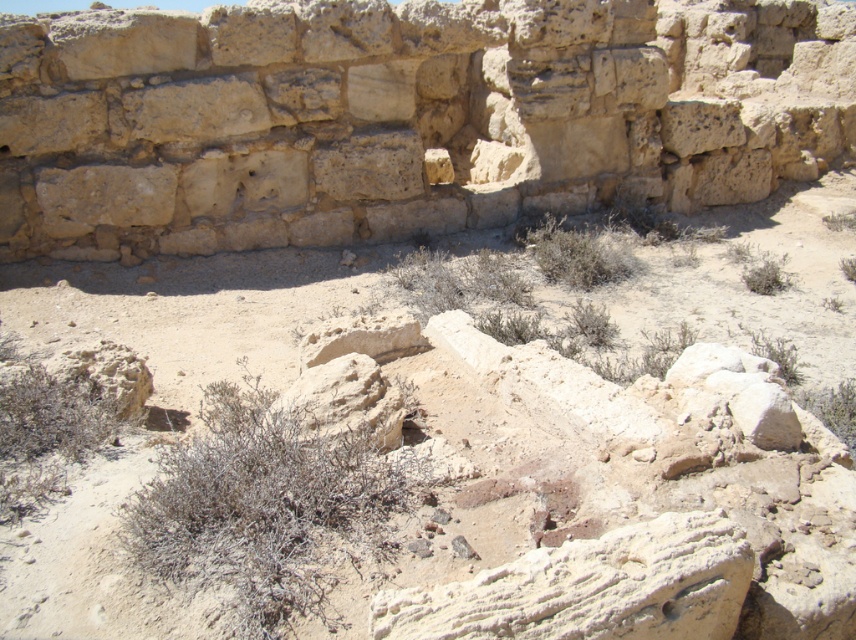
Can you confirm if beige stone wall at upper center is positioned to the left of smooth beige rock at center?

Incorrect, beige stone wall at upper center is not on the left side of smooth beige rock at center.

Does beige stone wall at upper center come behind smooth beige rock at center?

Yes, it is.

At what (x,y) coordinates should I click in order to perform the action: click on beige stone wall at upper center. Please return your answer as a coordinate pair (x, y). This screenshot has width=856, height=640. Looking at the image, I should click on (402, 116).

Locate an element on the screen. This screenshot has height=640, width=856. beige stone wall at upper center is located at coordinates (402, 116).

Which is above, beige stone wall at upper center or green shrub at center?

beige stone wall at upper center

Does beige stone wall at upper center have a larger size compared to green shrub at center?

Actually, beige stone wall at upper center might be smaller than green shrub at center.

Does point (110, 52) come closer to viewer compared to point (610, 246)?

Yes, point (110, 52) is closer to viewer.

What are the coordinates of `beige stone wall at upper center` in the screenshot? It's located at (402, 116).

This screenshot has width=856, height=640. What do you see at coordinates (260, 504) in the screenshot?
I see `dry shrub at center` at bounding box center [260, 504].

Is dry shrub at center thinner than smooth beige rock at center?

No.

The image size is (856, 640). In order to click on dry shrub at center in this screenshot , I will do `click(260, 504)`.

I want to click on dry shrub at center, so click(x=260, y=504).